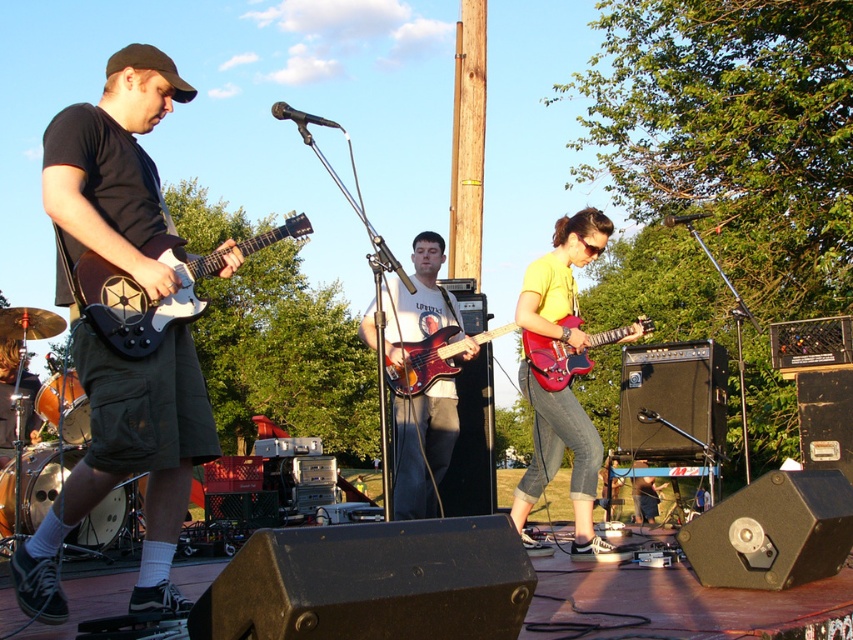
Question: Which point is farther to the camera?

Choices:
 (A) matte black guitar at left
 (B) white matte electric guitar at left

Answer: (B)

Question: Is matte black guitar at left above wooden bass guitar at center?

Choices:
 (A) no
 (B) yes

Answer: (B)

Question: Which point is farther from the camera taking this photo?

Choices:
 (A) [x=602, y=234]
 (B) [x=421, y=492]
 (C) [x=152, y=410]
 (D) [x=584, y=356]

Answer: (B)

Question: Does white matte electric guitar at left appear over glossy wood bass guitar at center?

Choices:
 (A) no
 (B) yes

Answer: (B)

Question: Does shiny red electric guitar at center lie behind glossy wood bass guitar at center?

Choices:
 (A) yes
 (B) no

Answer: (A)

Question: Which point is farther from the camera taking this photo?

Choices:
 (A) (408, 396)
 (B) (395, 285)
 (C) (161, 108)
 (D) (535, 362)

Answer: (B)